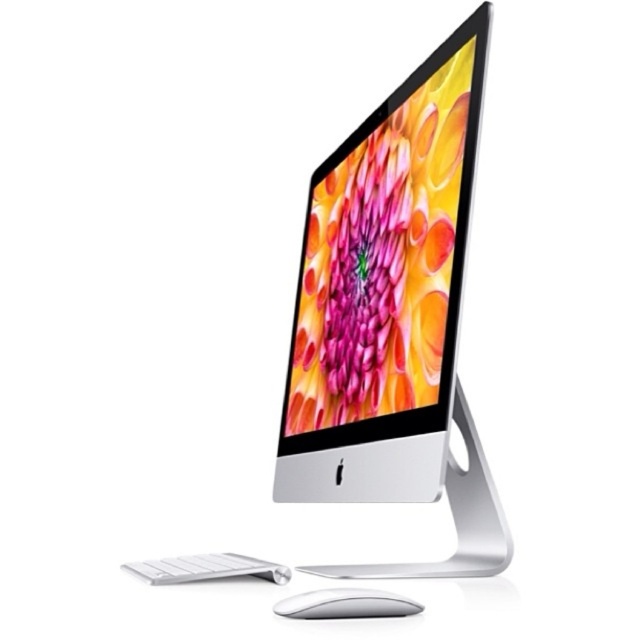
You are organizing cables behind your desk and need to route them from the back of the silver metallic computer monitor at center to the white matte keyboard at lower left. Since the monitor is closer to you, will the cables need to go under or over the keyboard to reach the back?

The silver metallic computer monitor at center is closer to the viewer than the white matte keyboard at lower left, so the cables would need to go under the keyboard to reach the back.

You are setting up a new monitor stand that requires at least 15 cm of vertical space between the top of the keyboard and the bottom of the monitor. Given the silver metallic desktop computer at center and the white matte keyboard at lower left, can the stand be placed between them?

The silver metallic desktop computer at center is taller than the white matte keyboard at lower left. Since the computer is higher, there should be sufficient vertical space between the keyboard and the computer to accommodate the 15 cm requirement for the monitor stand.